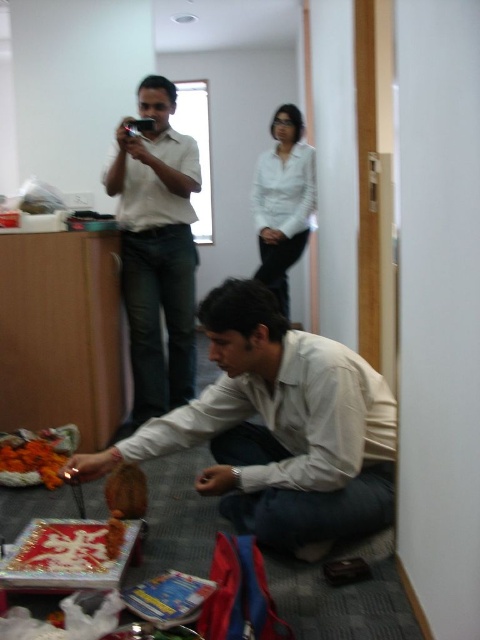
Question: Considering the real-world distances, which object is closest to the orange floral decoration at lower left?

Choices:
 (A) matte white shirt at lower center
 (B) white glossy shirt at upper center

Answer: (A)

Question: Is matte white shirt at upper left to the right of brown matte cake at lower center from the viewer's perspective?

Choices:
 (A) yes
 (B) no

Answer: (B)

Question: Can you confirm if matte white shirt at lower center is thinner than white glossy shirt at upper center?

Choices:
 (A) no
 (B) yes

Answer: (A)

Question: Is matte white shirt at lower center smaller than matte white shirt at upper left?

Choices:
 (A) yes
 (B) no

Answer: (A)

Question: Which object appears closest to the camera in this image?

Choices:
 (A) matte white shirt at upper left
 (B) orange floral decoration at lower left
 (C) white glossy shirt at upper center

Answer: (B)

Question: Which object is positioned farthest from the brown matte cake at lower center?

Choices:
 (A) matte white shirt at lower center
 (B) orange floral decoration at lower left

Answer: (B)